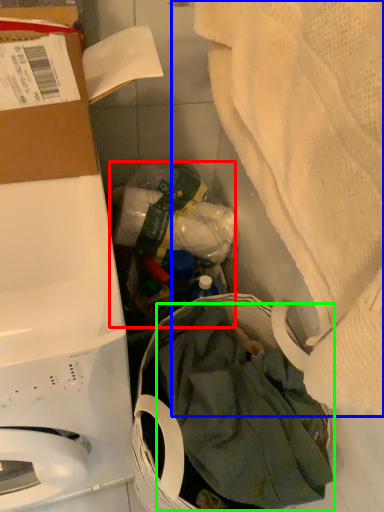
Question: Which object is the farthest from garbage (highlighted by a red box)? Choose among these: blanket (highlighted by a blue box) or clothing (highlighted by a green box).

Choices:
 (A) blanket
 (B) clothing

Answer: (A)